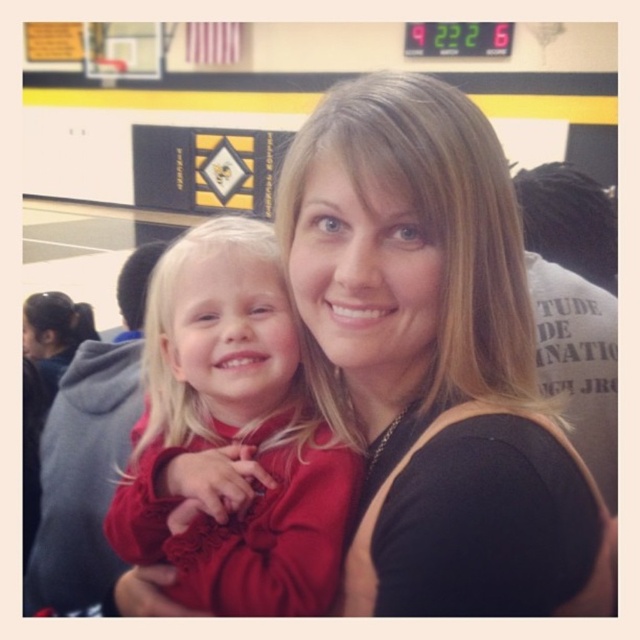
Who is taller, black fabric at center or matte red dress at center?

black fabric at center

Is black fabric at center thinner than matte red dress at center?

Correct, black fabric at center's width is less than matte red dress at center's.

Image resolution: width=640 pixels, height=640 pixels. Identify the location of black fabric at center. (435, 358).